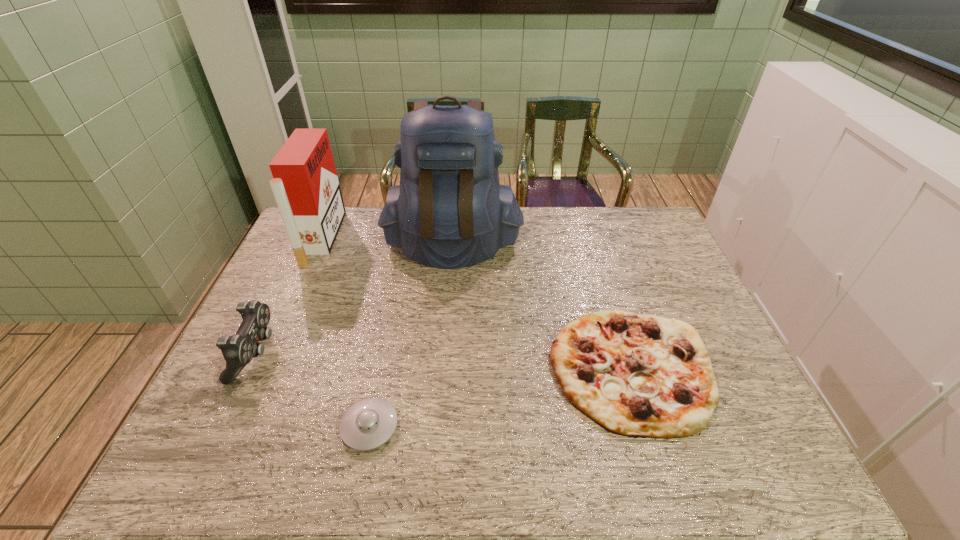
Where is `vacant space at the near edge of the desktop`? Image resolution: width=960 pixels, height=540 pixels. vacant space at the near edge of the desktop is located at coordinates pyautogui.click(x=261, y=449).

The image size is (960, 540). I want to click on vacant region at the left edge of the desktop, so click(x=205, y=420).

The image size is (960, 540). I want to click on vacant space at the right edge of the desktop, so click(x=703, y=307).

I want to click on vacant space at the far right corner, so click(x=627, y=241).

This screenshot has height=540, width=960. I want to click on vacant point located between the cigarette case and the shortest object, so click(346, 332).

Where is `free spot between the rightmost object and the shortest object`? free spot between the rightmost object and the shortest object is located at coordinates (500, 397).

What are the coordinates of `vacant point located between the backpack and the control` in the screenshot? It's located at (354, 299).

The width and height of the screenshot is (960, 540). In order to click on free area in between the second tallest object and the saucer in this screenshot , I will do `click(346, 332)`.

Locate an element on the screen. vacant area that lies between the cigarette case and the rightmost object is located at coordinates (476, 303).

Locate an element on the screen. The image size is (960, 540). free space between the rightmost object and the saucer is located at coordinates (500, 397).